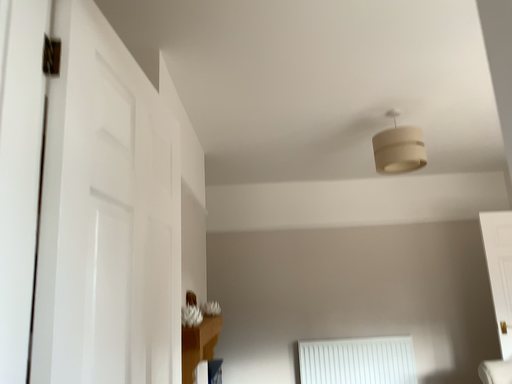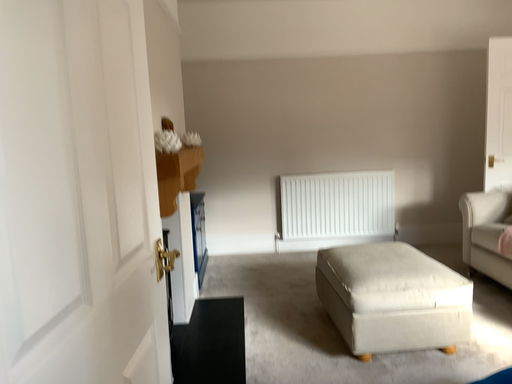
Question: How did the camera likely rotate when shooting the video?

Choices:
 (A) rotated upward
 (B) rotated downward

Answer: (B)